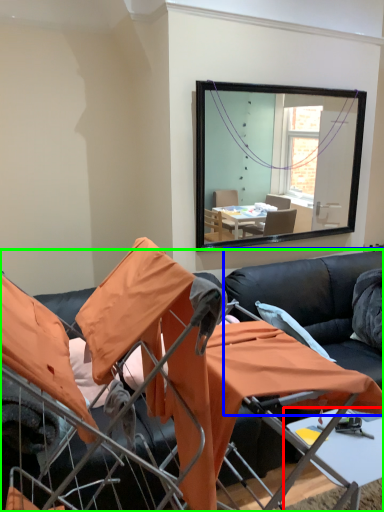
Question: Which object is positioned farthest from table (highlighted by a red box)? Select from couch (highlighted by a blue box) and studio couch (highlighted by a green box).

Choices:
 (A) couch
 (B) studio couch

Answer: (A)